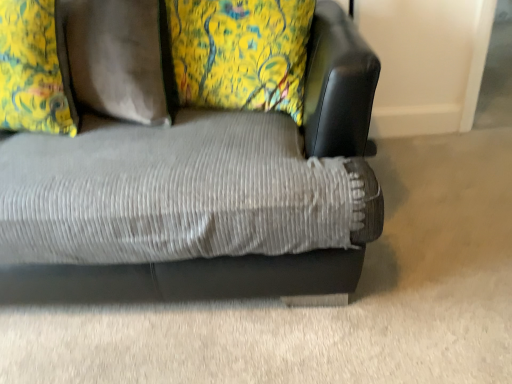
Question: Is floral fabric pillow at upper left looking in the opposite direction of corduroy fabric couch at center?

Choices:
 (A) yes
 (B) no

Answer: (A)

Question: Does floral fabric pillow at upper left appear on the left side of corduroy fabric couch at center?

Choices:
 (A) yes
 (B) no

Answer: (A)

Question: Is floral fabric pillow at upper left not close to corduroy fabric couch at center?

Choices:
 (A) no
 (B) yes

Answer: (A)

Question: Can you confirm if floral fabric pillow at upper left is wider than corduroy fabric couch at center?

Choices:
 (A) no
 (B) yes

Answer: (A)

Question: Can you confirm if floral fabric pillow at upper left is bigger than corduroy fabric couch at center?

Choices:
 (A) no
 (B) yes

Answer: (A)

Question: Is the position of floral fabric pillow at upper left less distant than that of corduroy fabric couch at center?

Choices:
 (A) yes
 (B) no

Answer: (B)

Question: Is corduroy fabric couch at center behind black leather swivel chair at upper right?

Choices:
 (A) yes
 (B) no

Answer: (B)

Question: Does corduroy fabric couch at center turn towards black leather swivel chair at upper right?

Choices:
 (A) yes
 (B) no

Answer: (B)

Question: Is corduroy fabric couch at center positioned with its back to black leather swivel chair at upper right?

Choices:
 (A) no
 (B) yes

Answer: (B)

Question: From the image's perspective, is corduroy fabric couch at center on top of black leather swivel chair at upper right?

Choices:
 (A) no
 (B) yes

Answer: (A)

Question: Can you confirm if corduroy fabric couch at center is bigger than black leather swivel chair at upper right?

Choices:
 (A) no
 (B) yes

Answer: (B)

Question: From a real-world perspective, does corduroy fabric couch at center stand above black leather swivel chair at upper right?

Choices:
 (A) yes
 (B) no

Answer: (B)

Question: Can you confirm if black leather swivel chair at upper right is smaller than corduroy fabric couch at center?

Choices:
 (A) yes
 (B) no

Answer: (A)